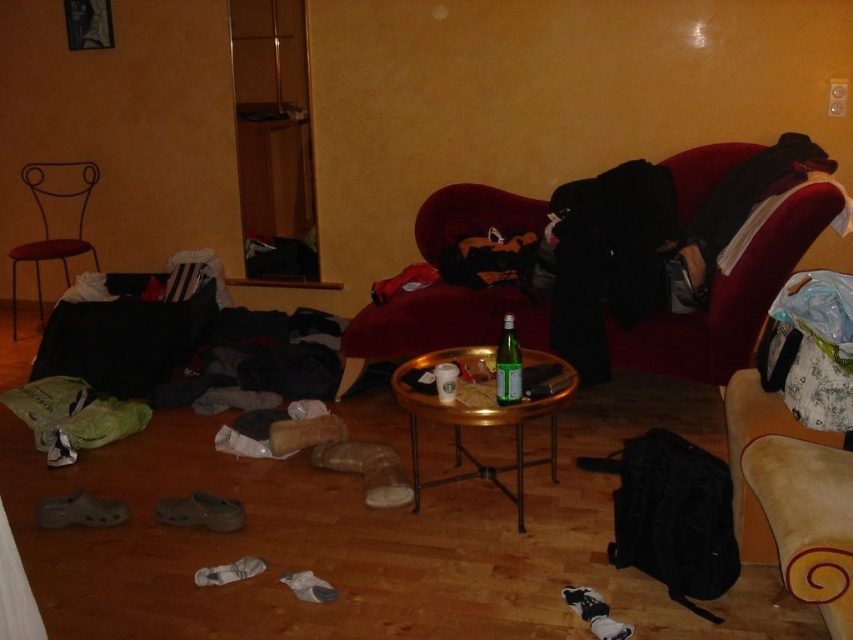
Question: Which point is closer to the camera?

Choices:
 (A) (462, 445)
 (B) (514, 342)
 (C) (641, 348)
 (D) (85, 168)

Answer: (B)

Question: Does velvet red couch at center have a lesser width compared to green glass bottle at center?

Choices:
 (A) yes
 (B) no

Answer: (B)

Question: Where is velvet red couch at center located in relation to green glass bottle at center in the image?

Choices:
 (A) left
 (B) right

Answer: (A)

Question: Which of the following is the closest to the observer?

Choices:
 (A) (463, 218)
 (B) (413, 499)
 (C) (39, 292)
 (D) (519, 376)

Answer: (D)

Question: Which point is farther to the camera?

Choices:
 (A) green glass bottle at center
 (B) metallic red chair at left

Answer: (B)

Question: Is velvet red couch at center to the left of green glass bottle at center from the viewer's perspective?

Choices:
 (A) no
 (B) yes

Answer: (B)